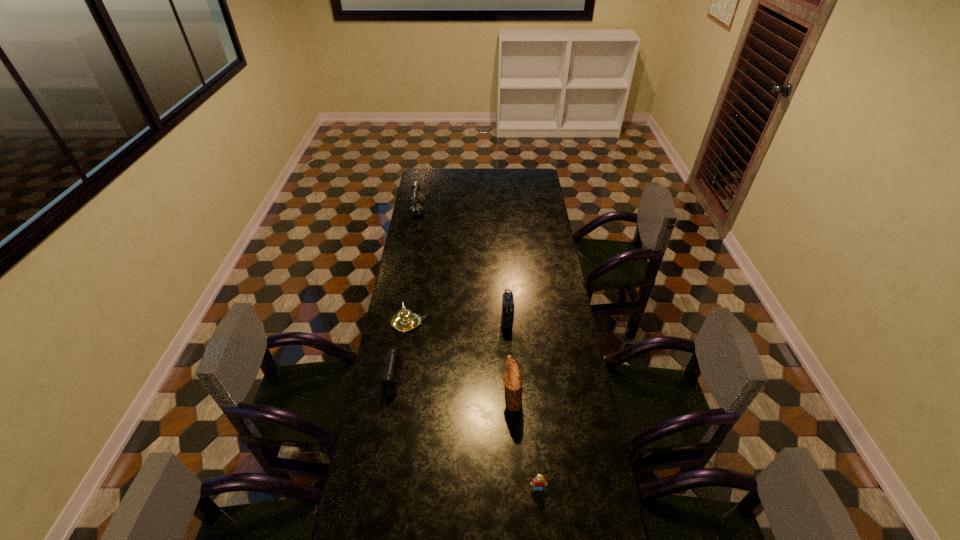
Where is `vacant space that's between the third shortest object and the Lego`? This screenshot has height=540, width=960. vacant space that's between the third shortest object and the Lego is located at coordinates (473, 406).

The width and height of the screenshot is (960, 540). I want to click on free spot between the earphone and the leftmost clutch bag, so click(407, 295).

The height and width of the screenshot is (540, 960). Identify the location of empty location between the candle holder and the shortest clutch bag. (402, 351).

Find the location of a particular element. vacant region between the farthest object and the fourth tallest object is located at coordinates (413, 267).

This screenshot has width=960, height=540. I want to click on blank region between the third shortest object and the shortest clutch bag, so click(x=402, y=351).

The image size is (960, 540). Identify the location of free space between the farthest clutch bag and the nearest object. (522, 405).

Locate an element on the screen. object that is the second closest to the leftmost clutch bag is located at coordinates point(512,379).

You are a GUI agent. You are given a task and a screenshot of the screen. Output one action in this format:
    pyautogui.click(x=<x>, y=<y>)
    Task: Click on the object that can be found as the second closest to the third shortest object
    
    Given the screenshot: What is the action you would take?
    pyautogui.click(x=507, y=316)

This screenshot has width=960, height=540. I want to click on clutch bag that is the closest one to the fourth tallest object, so click(391, 370).

Find the location of a particular element. The height and width of the screenshot is (540, 960). clutch bag identified as the closest to the earphone is located at coordinates (507, 316).